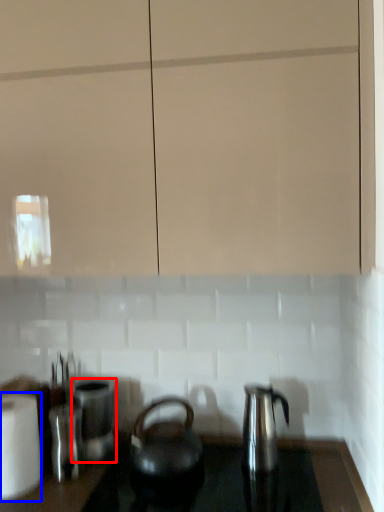
Question: Which object is further to the camera taking this photo, appliance (highlighted by a red box) or kitchen appliance (highlighted by a blue box)?

Choices:
 (A) appliance
 (B) kitchen appliance

Answer: (A)